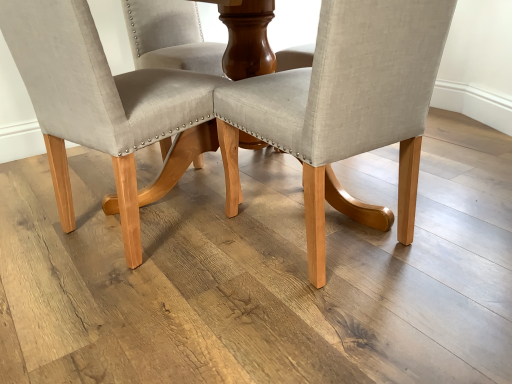
At what (x,y) coordinates should I click in order to perform the action: click on vacant area that is in front of beige fabric chair at center, placed as the 1th chair when sorted from right to left. Please return your answer as a coordinate pair (x, y). The height and width of the screenshot is (384, 512). Looking at the image, I should click on (335, 322).